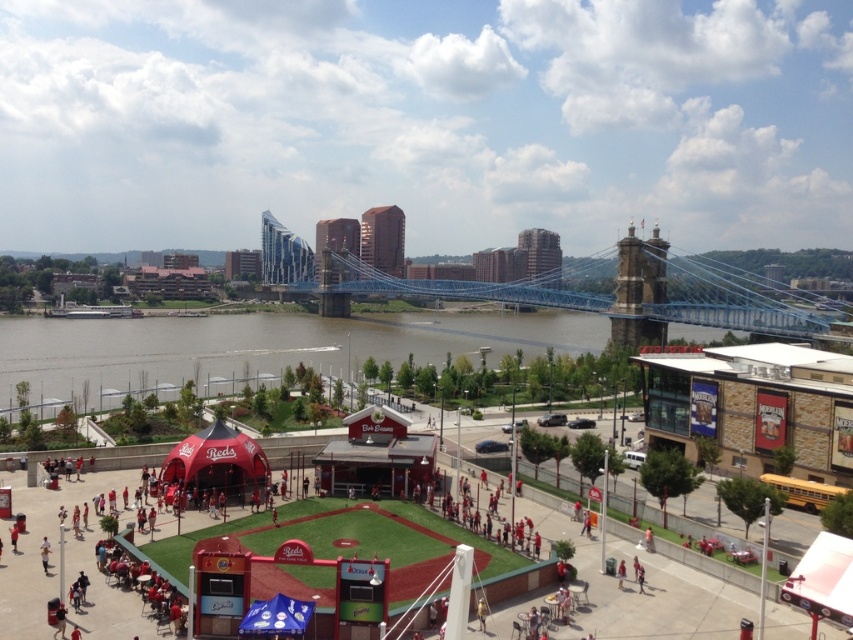
Question: Can you confirm if red fabric tent at center is positioned above blue metallic suspension bridge at center?

Choices:
 (A) no
 (B) yes

Answer: (A)

Question: Is red fabric tent at center smaller than blue metallic suspension bridge at center?

Choices:
 (A) no
 (B) yes

Answer: (B)

Question: Which object is farther from the camera taking this photo?

Choices:
 (A) red fabric tent at center
 (B) blue metallic suspension bridge at center

Answer: (B)

Question: Observing the image, what is the correct spatial positioning of red fabric tent at center in reference to blue metallic suspension bridge at center?

Choices:
 (A) left
 (B) right

Answer: (A)

Question: Which of the following is the farthest from the observer?

Choices:
 (A) (833, 304)
 (B) (426, 356)

Answer: (A)